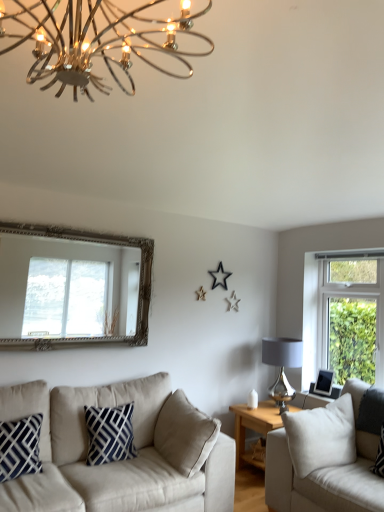
Question: Considering the positions of silver ornate mirror at upper left and matte gray glass lampshade at right, the first lamp when ordered from right to left, in the image, is silver ornate mirror at upper left wider or thinner than matte gray glass lampshade at right, the first lamp when ordered from right to left,?

Choices:
 (A) thin
 (B) wide

Answer: (A)

Question: From the image's perspective, is silver ornate mirror at upper left above or below matte gray glass lampshade at right, which appears as the 2th lamp when viewed from the front?

Choices:
 (A) below
 (B) above

Answer: (B)

Question: Estimate the real-world distances between objects in this image. Which object is closer to the white fabric couch at right, positioned as the 2th studio couch in left-to-right order?

Choices:
 (A) silver ornate mirror at upper left
 (B) beige fabric couch at lower left, marked as the second studio couch in a right-to-left arrangement
 (C) wooden side table at center
 (D) black plastic picture frame at right
 (E) metallic chandelier at upper center, acting as the 1th lamp starting from the left

Answer: (C)

Question: Which object is the closest to the metallic chandelier at upper center, acting as the second lamp starting from the right?

Choices:
 (A) wooden side table at center
 (B) white fabric couch at right, positioned as the 2th studio couch in left-to-right order
 (C) silver ornate mirror at upper left
 (D) beige fabric couch at lower left, which is the 1th studio couch from left to right
 (E) matte gray glass lampshade at right, the first lamp positioned from the bottom

Answer: (C)